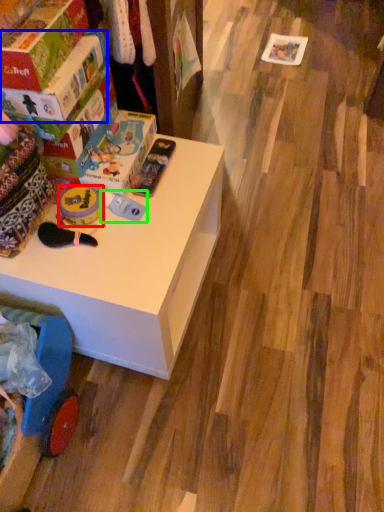
Question: Estimate the real-world distances between objects in this image. Which object is closer to toy (highlighted by a red box), box (highlighted by a blue box) or toy (highlighted by a green box)?

Choices:
 (A) box
 (B) toy

Answer: (B)